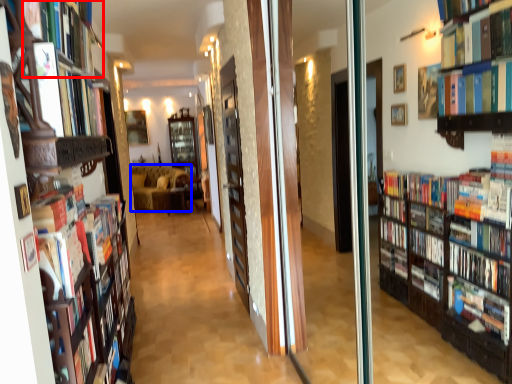
Question: Which object is closer to the camera taking this photo, book (highlighted by a red box) or couch (highlighted by a blue box)?

Choices:
 (A) book
 (B) couch

Answer: (A)